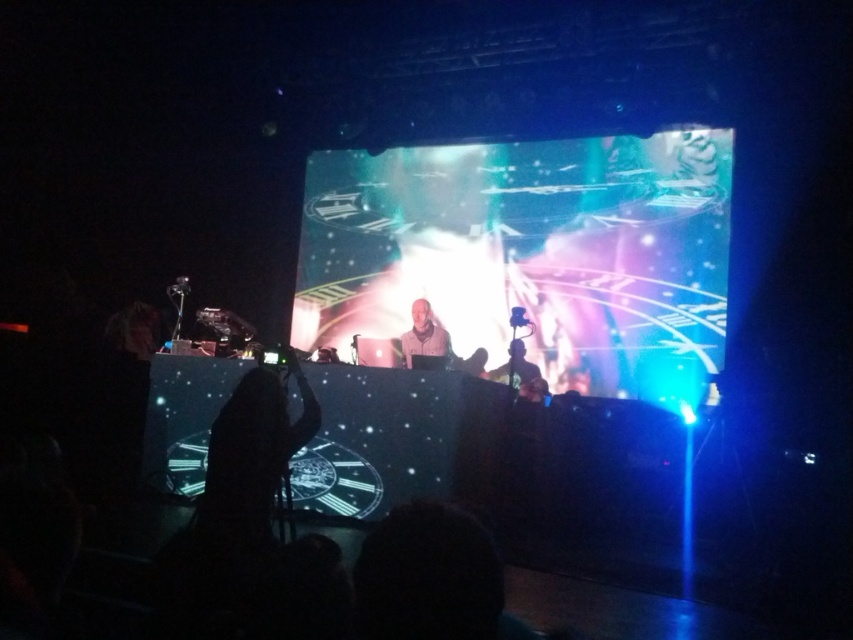
You are a stagehand needing to place a 7.5 feet long extension cord between the black fabric at center and the matte white headphones at center. Can the extension cord fit between them without bending?

→ The black fabric at center is 7.49 feet from matte white headphones at center. Since the extension cord is 7.5 feet long, it is slightly longer than the distance between them, so it cannot fit without bending.

You are a photographer at the concert and need to position your camera to capture both the black fabric at center and the matte white headphones at center. Which object should you adjust your camera angle to focus on first if you want to ensure both are in frame?

You should focus on the black fabric at center first since it is positioned to the left of the matte white headphones at center, ensuring both are within the camera frame by starting from the left side.